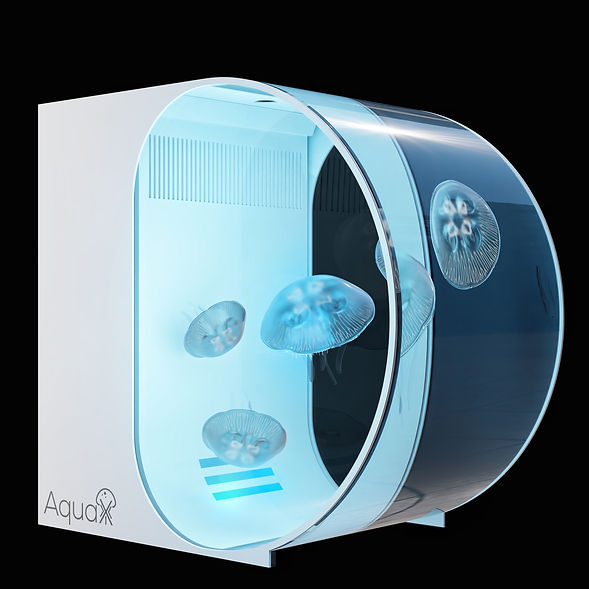
Where is `vent`? This screenshot has width=589, height=589. vent is located at coordinates (188, 173).